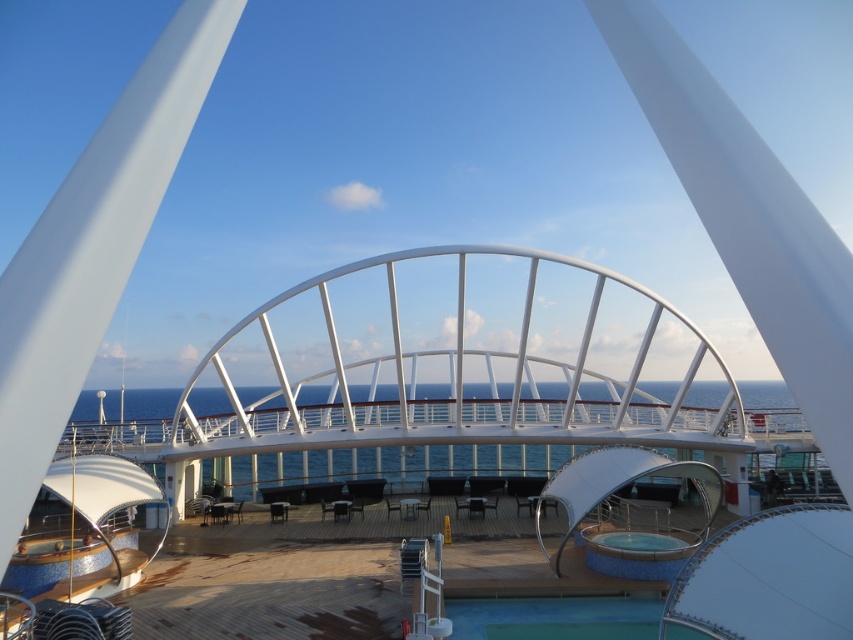
Question: Which point is closer to the camera?

Choices:
 (A) coord(654,602)
 (B) coord(645,534)

Answer: (A)

Question: Does green rubber pool at lower center have a greater width compared to clear glass pool at center?

Choices:
 (A) no
 (B) yes

Answer: (B)

Question: Is green rubber pool at lower center above clear glass pool at center?

Choices:
 (A) yes
 (B) no

Answer: (B)

Question: Is green rubber pool at lower center above clear glass pool at center?

Choices:
 (A) yes
 (B) no

Answer: (B)

Question: Among these points, which one is nearest to the camera?

Choices:
 (A) (604, 538)
 (B) (529, 634)

Answer: (B)

Question: Which point is farther from the camera taking this photo?

Choices:
 (A) (606, 540)
 (B) (567, 636)

Answer: (A)